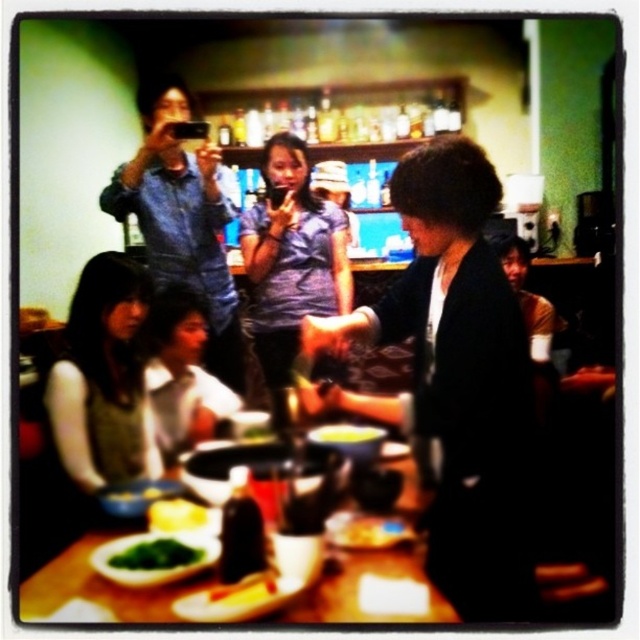
You are a photographer setting up a shot at the table. You need to ensure that the white fabric shirt at lower left and the green leafy vegetable at lower left are both in frame. Since you want to focus on the shirt, which object should you adjust the camera angle to prioritize, and why?

You should prioritize the white fabric shirt at lower left because its width surpasses the green leafy vegetable at lower left, making it a larger subject and thus more visually dominant in the frame.